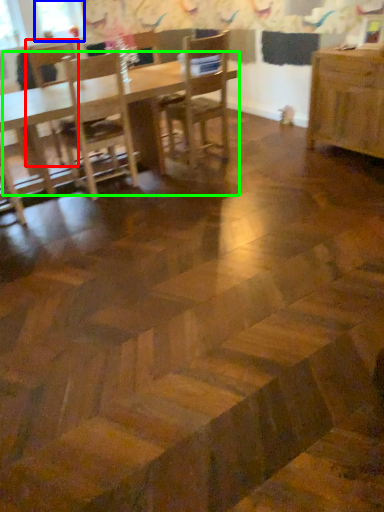
Question: Based on their relative distances, which object is nearer to chair (highlighted by a red box)? Choose from window screen (highlighted by a blue box) and table (highlighted by a green box).

Choices:
 (A) window screen
 (B) table

Answer: (A)